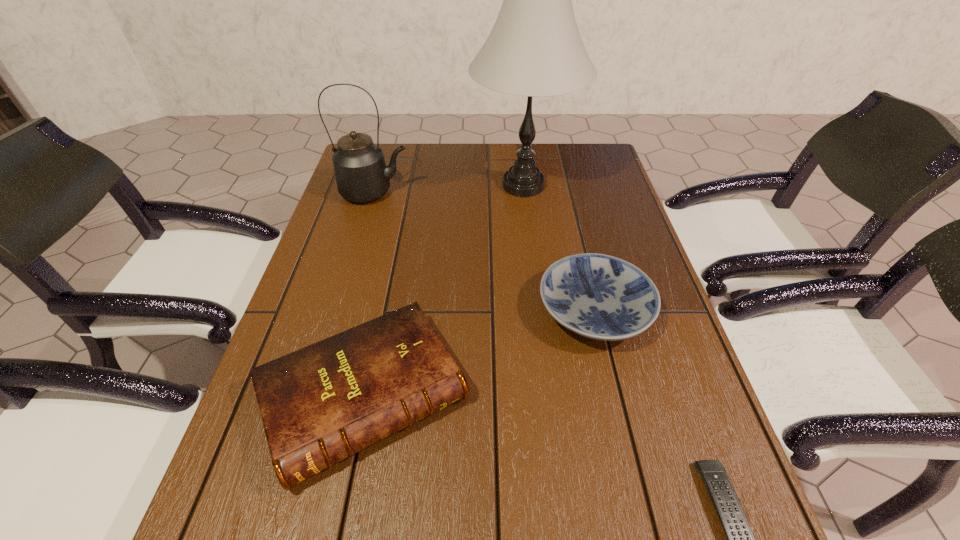
Identify the location of lamp. The image size is (960, 540). (534, 49).

The image size is (960, 540). I want to click on kettle, so click(x=361, y=173).

Find the location of a particular element. This screenshot has height=540, width=960. plate is located at coordinates (598, 296).

At what (x,y) coordinates should I click in order to perform the action: click on hardback book. Please return your answer as a coordinate pair (x, y). The image size is (960, 540). Looking at the image, I should click on (325, 402).

Image resolution: width=960 pixels, height=540 pixels. In order to click on free space located on the front of the tallest object in this screenshot , I will do `click(537, 293)`.

The width and height of the screenshot is (960, 540). What are the coordinates of `free space located 0.180m spout on the fourth shortest object` in the screenshot? It's located at (471, 193).

I want to click on free location located on the left of the plate, so click(490, 311).

The height and width of the screenshot is (540, 960). Identify the location of free location located 0.260m on the back of the hardback book. (396, 245).

The width and height of the screenshot is (960, 540). In order to click on lamp that is positioned at the far edge in this screenshot , I will do `click(534, 49)`.

Locate an element on the screen. kettle at the far edge is located at coordinates (361, 173).